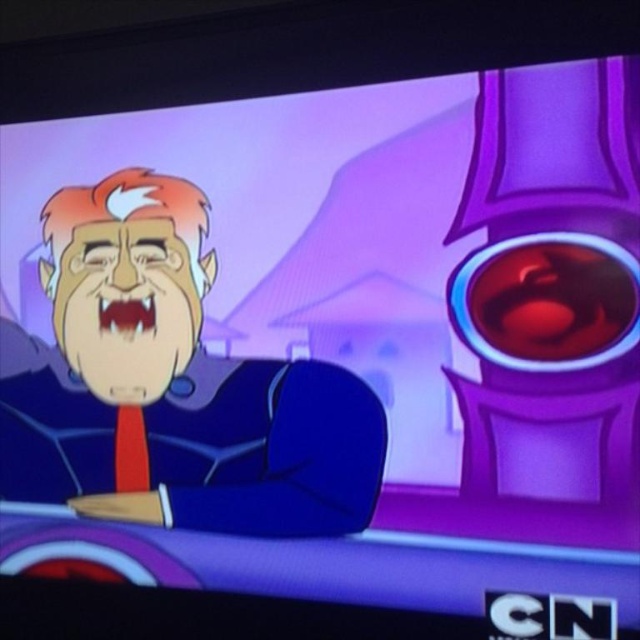
Question: Is matte black suit at left bigger than red matte tie at lower left?

Choices:
 (A) yes
 (B) no

Answer: (A)

Question: Does matte black suit at left have a greater width compared to red matte tie at lower left?

Choices:
 (A) yes
 (B) no

Answer: (A)

Question: Which point appears farthest from the camera in this image?

Choices:
 (A) (120, 209)
 (B) (122, 420)

Answer: (B)

Question: Does matte black suit at left appear over red matte tie at lower left?

Choices:
 (A) yes
 (B) no

Answer: (A)

Question: Which of the following is the closest to the observer?

Choices:
 (A) red matte tie at lower left
 (B) matte black suit at left

Answer: (B)

Question: Which point is farther to the camera?

Choices:
 (A) red matte tie at lower left
 (B) matte black suit at left

Answer: (A)